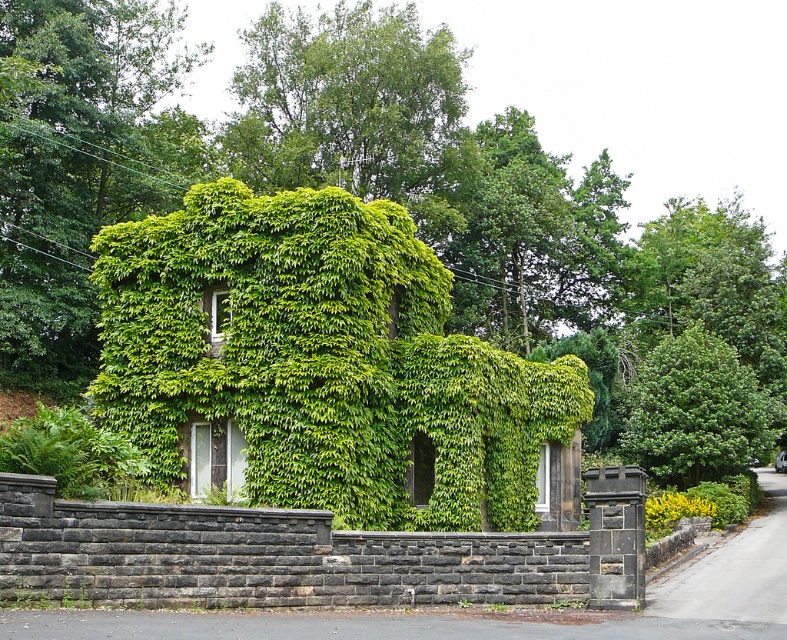
Can you confirm if green leafy ivy at upper left is taller than green leafy tree at right?

Yes.

Does point (76, 342) come in front of point (715, 349)?

No, it is not.

This screenshot has height=640, width=787. Find the location of `green leafy ivy at upper left`. green leafy ivy at upper left is located at coordinates (80, 164).

Find the location of a particular element. This screenshot has height=640, width=787. green leafy ivy at upper left is located at coordinates (80, 164).